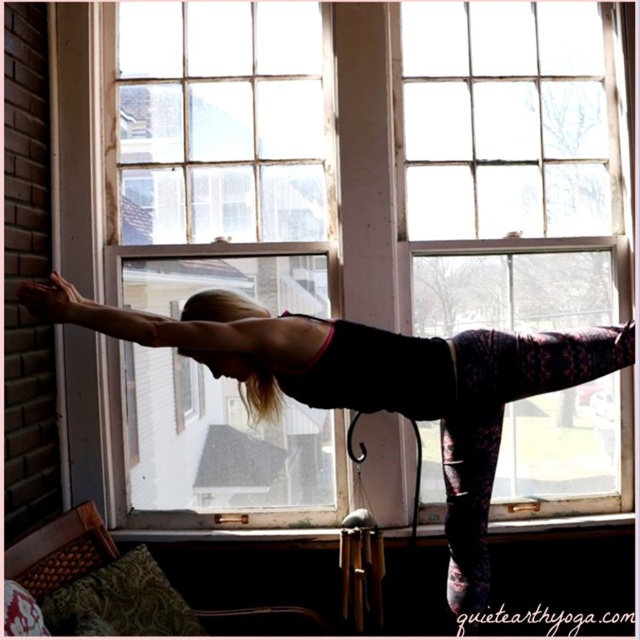
Measure the distance between point (204, 516) and camera.

They are 9.54 feet apart.

This screenshot has width=640, height=640. What are the coordinates of `clear glass window at center` in the screenshot? It's located at (225, 154).